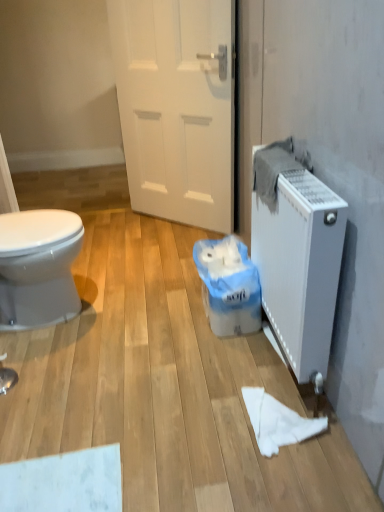
Question: In the image, is white matte radiator at right on the left side or the right side of white plastic bag at center?

Choices:
 (A) right
 (B) left

Answer: (A)

Question: Is white matte radiator at right spatially inside white plastic bag at center, or outside of it?

Choices:
 (A) outside
 (B) inside

Answer: (A)

Question: Which object is positioned farthest from the white plastic bag at center?

Choices:
 (A) white matte door at center
 (B) white paper towel at lower center
 (C) white matte radiator at right

Answer: (A)

Question: Which is farther from the white paper towel at lower center?

Choices:
 (A) white matte radiator at right
 (B) white matte door at center
 (C) white plastic bag at center

Answer: (B)